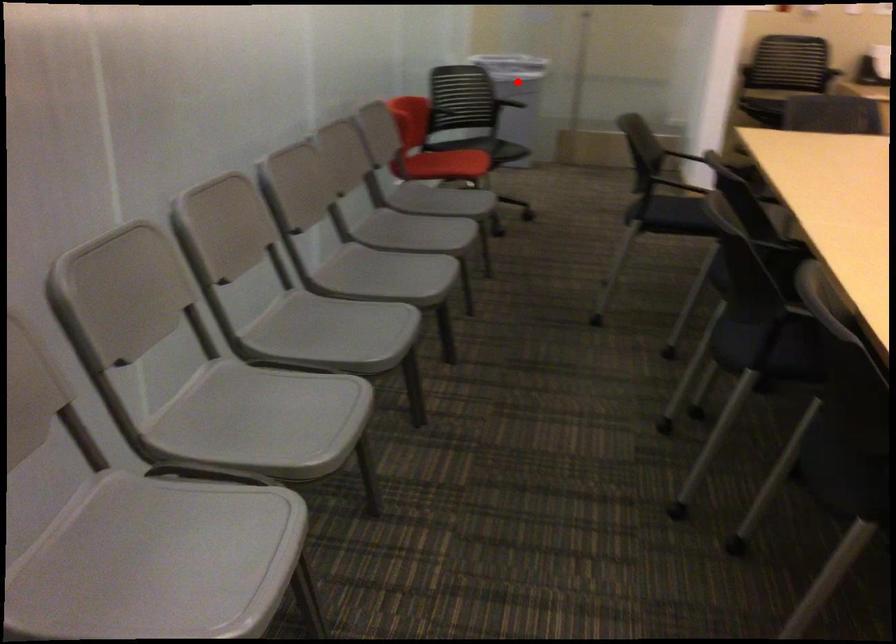
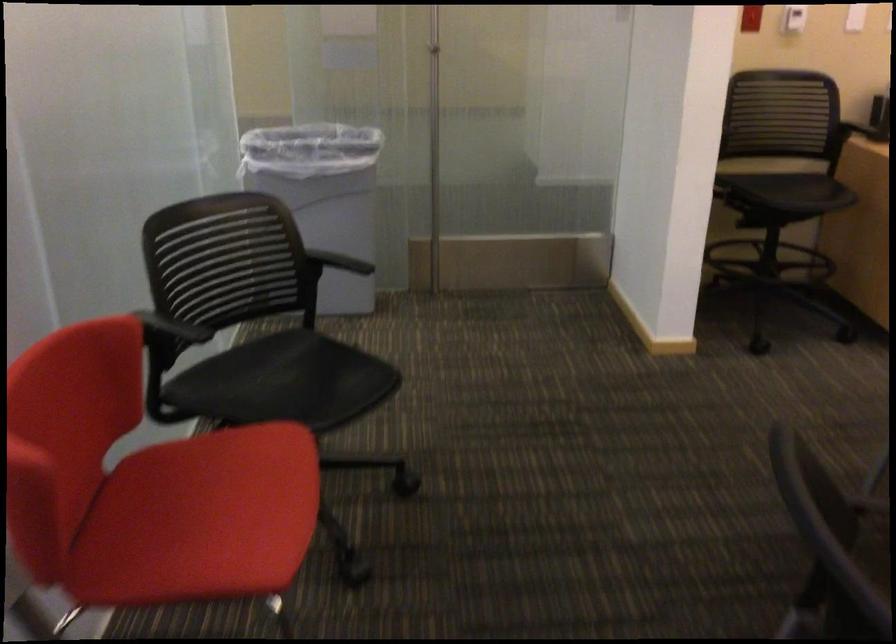
Locate, in the second image, the point that corresponds to the highlighted location in the first image.

(323, 196)